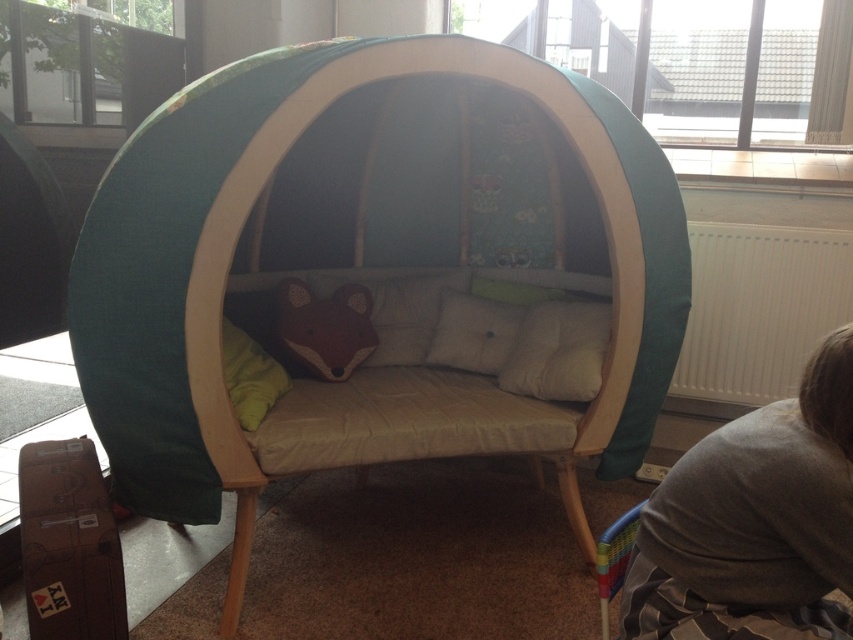
Question: Does teal fabric tent at center have a greater width compared to white ribbed radiator at right?

Choices:
 (A) no
 (B) yes

Answer: (B)

Question: Does soft beige cushion at center appear on the right side of white soft pillow at center?

Choices:
 (A) no
 (B) yes

Answer: (B)

Question: Among these objects, which one is nearest to the camera?

Choices:
 (A) teal fabric tent at center
 (B) beige fabric pillow at center
 (C) brown cardboard suitcase at lower left

Answer: (C)

Question: Which point is closer to the camera?

Choices:
 (A) (234, 353)
 (B) (389, 324)
 (C) (352, 362)

Answer: (A)

Question: Based on their relative distances, which object is nearer to the soft beige cushion at center?

Choices:
 (A) brown plush pillow at center
 (B) teal fabric tent at center
 (C) beige fabric pillow at center

Answer: (B)

Question: Can you confirm if gray fabric at lower right is positioned to the left of white ribbed radiator at right?

Choices:
 (A) no
 (B) yes

Answer: (B)